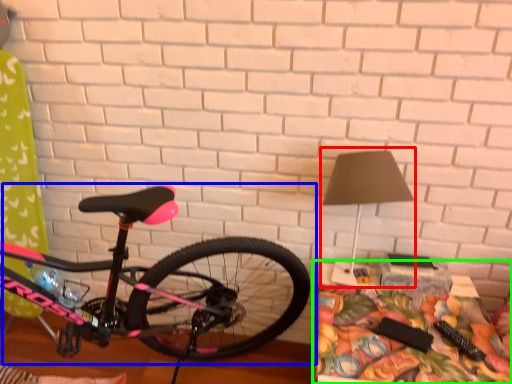
Question: Which object is positioned closest to table lamp (highlighted by a red box)? Select from bicycle (highlighted by a blue box) and table (highlighted by a green box).

Choices:
 (A) bicycle
 (B) table

Answer: (B)